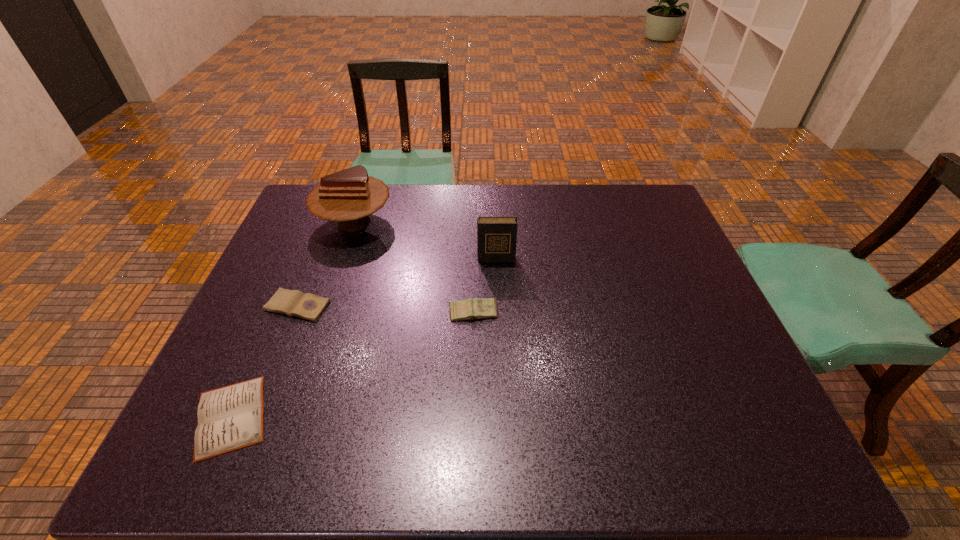
Identify the location of object located in the near edge section of the desktop. This screenshot has width=960, height=540. (229, 418).

Locate an element on the screen. cake that is positioned at the left edge is located at coordinates (348, 197).

Where is `object positioned at the far left corner`? object positioned at the far left corner is located at coordinates (348, 197).

Where is `object that is at the near left corner`? object that is at the near left corner is located at coordinates (229, 418).

Find the location of a particular element. The height and width of the screenshot is (540, 960). blank area at the far edge is located at coordinates (473, 210).

You are a GUI agent. You are given a task and a screenshot of the screen. Output one action in this format:
    pyautogui.click(x=<x>, y=<y>)
    Task: Click on the vacant region at the near edge of the desktop
    The image size is (960, 540).
    Given the screenshot: What is the action you would take?
    pyautogui.click(x=478, y=428)

Find the location of `free location at the left edge`. free location at the left edge is located at coordinates (247, 361).

In the image, there is a desktop. At what (x,y) coordinates should I click in order to perform the action: click on vacant space at the right edge. Please return your answer as a coordinate pair (x, y). The width and height of the screenshot is (960, 540). Looking at the image, I should click on (713, 313).

Locate an element on the screen. The width and height of the screenshot is (960, 540). free space at the far right corner of the desktop is located at coordinates (646, 193).

Where is `vacant point located between the second farthest object and the farthest object`? The height and width of the screenshot is (540, 960). vacant point located between the second farthest object and the farthest object is located at coordinates (425, 240).